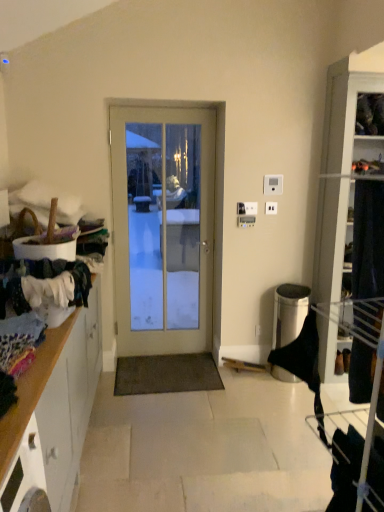
Question: Which direction should I rotate to look at white plastic light switch at upper center, acting as the first light switch starting from the right?

Choices:
 (A) right
 (B) left

Answer: (A)

Question: Is white plastic electric outlet at center in contact with white plastic light switch at upper center, marked as the 1th light switch in a bottom-to-top arrangement?

Choices:
 (A) yes
 (B) no

Answer: (B)

Question: From the image's perspective, would you say white plastic electric outlet at center is positioned over white plastic light switch at upper center, the 2th light switch positioned from the top?

Choices:
 (A) yes
 (B) no

Answer: (B)

Question: Is white plastic electric outlet at center surrounding white plastic light switch at upper center, which appears as the 1th light switch when viewed from the left?

Choices:
 (A) yes
 (B) no

Answer: (B)

Question: Can you confirm if white plastic electric outlet at center is wider than white plastic light switch at upper center, placed as the 2th light switch when sorted from right to left?

Choices:
 (A) yes
 (B) no

Answer: (B)

Question: Is white plastic electric outlet at center not close to white plastic light switch at upper center, the 2th light switch positioned from the top?

Choices:
 (A) no
 (B) yes

Answer: (A)

Question: Does white plastic electric outlet at center appear on the right side of white plastic light switch at upper center, which appears as the 1th light switch when viewed from the left?

Choices:
 (A) no
 (B) yes

Answer: (B)

Question: Does white plastic light switch at upper center, placed as the first light switch when sorted from top to bottom, have a lesser height compared to white plastic light switch at upper center, which appears as the 1th light switch when viewed from the left?

Choices:
 (A) yes
 (B) no

Answer: (B)

Question: Is white plastic light switch at upper center, which is the 2th light switch in left-to-right order, not within white plastic light switch at upper center, placed as the 2th light switch when sorted from right to left?

Choices:
 (A) no
 (B) yes

Answer: (B)

Question: From the image's perspective, does white plastic light switch at upper center, acting as the first light switch starting from the right, appear lower than white plastic light switch at upper center, which appears as the 1th light switch when viewed from the left?

Choices:
 (A) yes
 (B) no

Answer: (B)

Question: Considering the relative sizes of white plastic light switch at upper center, placed as the first light switch when sorted from top to bottom, and white plastic light switch at upper center, marked as the 1th light switch in a bottom-to-top arrangement, in the image provided, is white plastic light switch at upper center, placed as the first light switch when sorted from top to bottom, thinner than white plastic light switch at upper center, marked as the 1th light switch in a bottom-to-top arrangement,?

Choices:
 (A) yes
 (B) no

Answer: (A)

Question: Is white plastic light switch at upper center, which is the 2th light switch in left-to-right order, bigger than white plastic light switch at upper center, marked as the 1th light switch in a bottom-to-top arrangement?

Choices:
 (A) no
 (B) yes

Answer: (A)

Question: Can you confirm if white plastic light switch at upper center, the 2th light switch ordered from the bottom, is positioned to the right of white plastic light switch at upper center, the 2th light switch positioned from the top?

Choices:
 (A) yes
 (B) no

Answer: (A)

Question: Is white plastic electric outlet at center positioned with its back to white glass door at center?

Choices:
 (A) yes
 (B) no

Answer: (B)